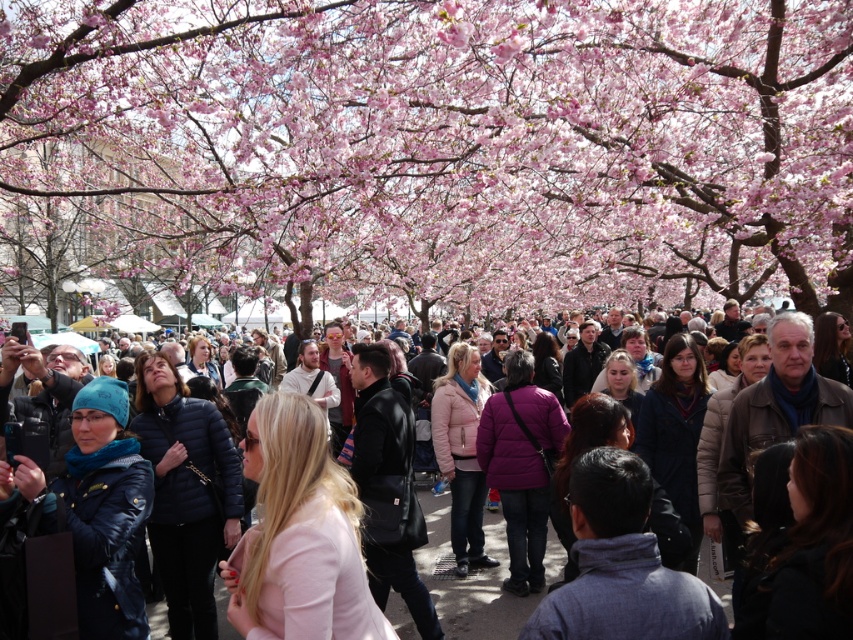
Does pink blossoms at center come behind matte black jacket at center?

Yes, pink blossoms at center is behind matte black jacket at center.

Between pink blossoms at center and matte black jacket at center, which one is positioned higher?

pink blossoms at center

At what (x,y) coordinates should I click in order to perform the action: click on pink blossoms at center. Please return your answer as a coordinate pair (x, y). This screenshot has width=853, height=640. Looking at the image, I should click on (422, 154).

Where is `pink blossoms at center`? This screenshot has height=640, width=853. pink blossoms at center is located at coordinates (422, 154).